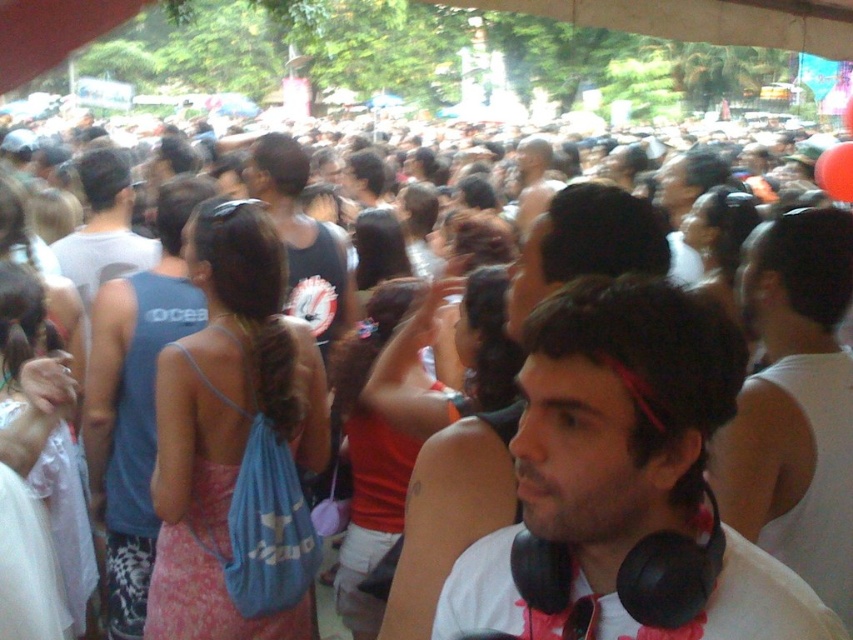
Can you confirm if black matte headphones at center is positioned above white matte headphones at center?

Incorrect, black matte headphones at center is not positioned above white matte headphones at center.

Is point (631, 554) behind point (645, 216)?

No, (631, 554) is closer to viewer.

Is point (717, 600) positioned after point (424, 316)?

No.

This screenshot has width=853, height=640. What are the coordinates of `black matte headphones at center` in the screenshot? It's located at (625, 481).

Is white matte tank top at center to the left of blue fabric tank top at left from the viewer's perspective?

No, white matte tank top at center is not to the left of blue fabric tank top at left.

Does point (766, 376) lie in front of point (181, 317)?

Yes, point (766, 376) is closer to viewer.

Locate an element on the screen. white matte tank top at center is located at coordinates (793, 404).

Is white matte tank top at center taller than white matte headphones at center?

Yes.

This screenshot has height=640, width=853. What do you see at coordinates (793, 404) in the screenshot?
I see `white matte tank top at center` at bounding box center [793, 404].

Locate an element on the screen. white matte tank top at center is located at coordinates (793, 404).